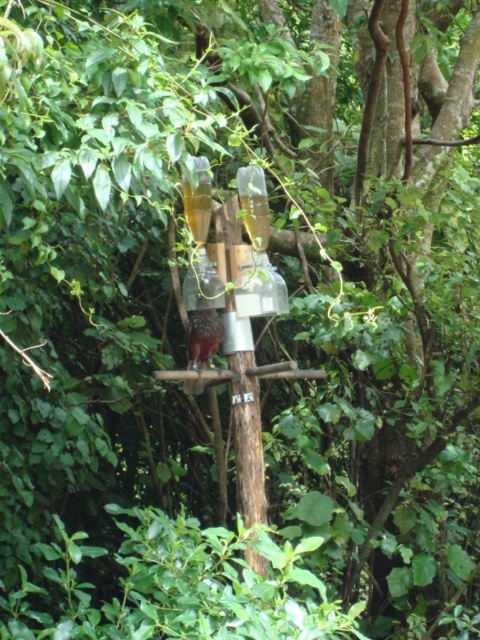
Question: Can you confirm if transparent glass bottle at center is bigger than brown speckled feathers at center?

Choices:
 (A) no
 (B) yes

Answer: (B)

Question: Which of the following is the closest to the observer?

Choices:
 (A) brown speckled feathers at center
 (B) transparent glass bottle at center

Answer: (B)

Question: Is transparent glass bottle at center positioned in front of brown speckled feathers at center?

Choices:
 (A) yes
 (B) no

Answer: (A)

Question: Which of the following is the farthest from the observer?

Choices:
 (A) (191, 272)
 (B) (206, 328)

Answer: (B)

Question: Which point is closer to the camera?

Choices:
 (A) transparent glass bottle at center
 (B) brown speckled feathers at center

Answer: (A)

Question: Is transparent glass bottle at center wider than brown speckled feathers at center?

Choices:
 (A) no
 (B) yes

Answer: (B)